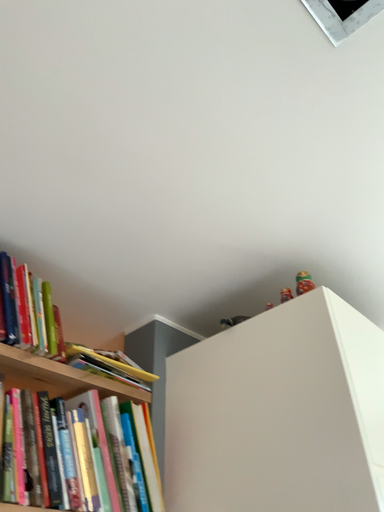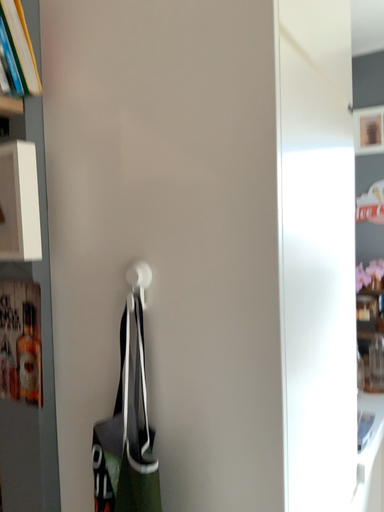
Question: How did the camera likely rotate when shooting the video?

Choices:
 (A) rotated downward
 (B) rotated upward

Answer: (A)